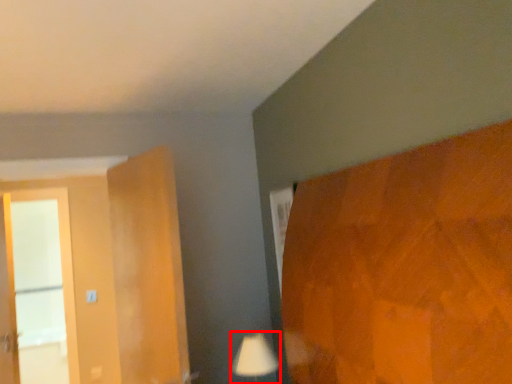
Question: From the image's perspective, what is the correct spatial relationship of table lamp (annotated by the red box) in relation to screen door?

Choices:
 (A) below
 (B) above

Answer: (A)